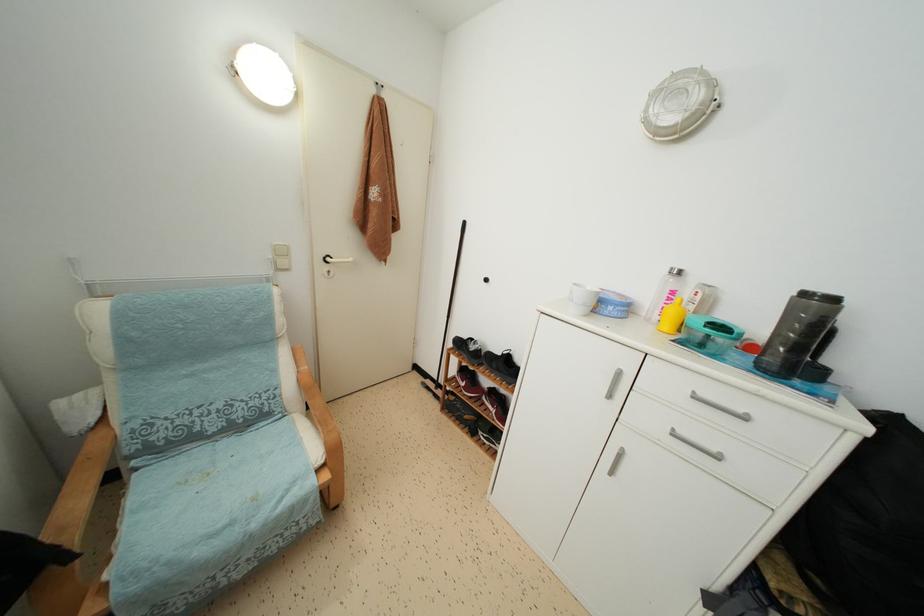
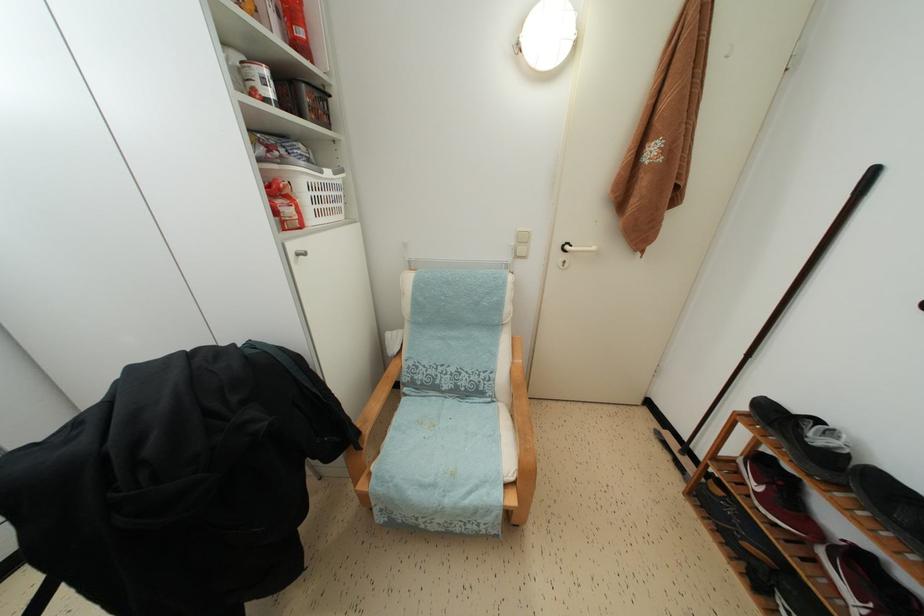
Find the pixel in the second image that matches point (96, 435) in the first image.

(399, 362)